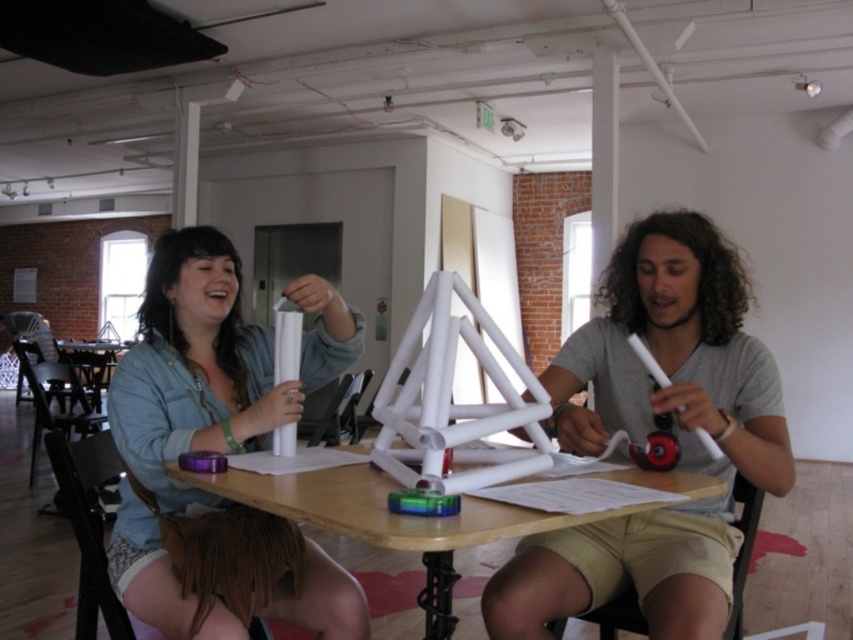
Which is behind, point (701, 524) or point (695, 474)?

The point (701, 524) is behind.

Can you confirm if white matte triangle at center is thinner than wooden table at center?

Yes, white matte triangle at center is thinner than wooden table at center.

Find the location of `white matte triangle at center`. white matte triangle at center is located at coordinates (675, 356).

Who is positioned more to the right, white matte triangle at center or matte white paper at center?

From the viewer's perspective, white matte triangle at center appears more on the right side.

Find the location of a particular element. white matte triangle at center is located at coordinates (675, 356).

Who is more forward, (167, 276) or (393, 547)?

Point (393, 547) is more forward.

Which of these two, matte white paper at center or wooden table at center, stands shorter?

wooden table at center is shorter.

Is point (228, 401) positioned behind point (233, 477)?

Yes, point (228, 401) is farther from viewer.

Where is `matte white paper at center`? matte white paper at center is located at coordinates (218, 451).